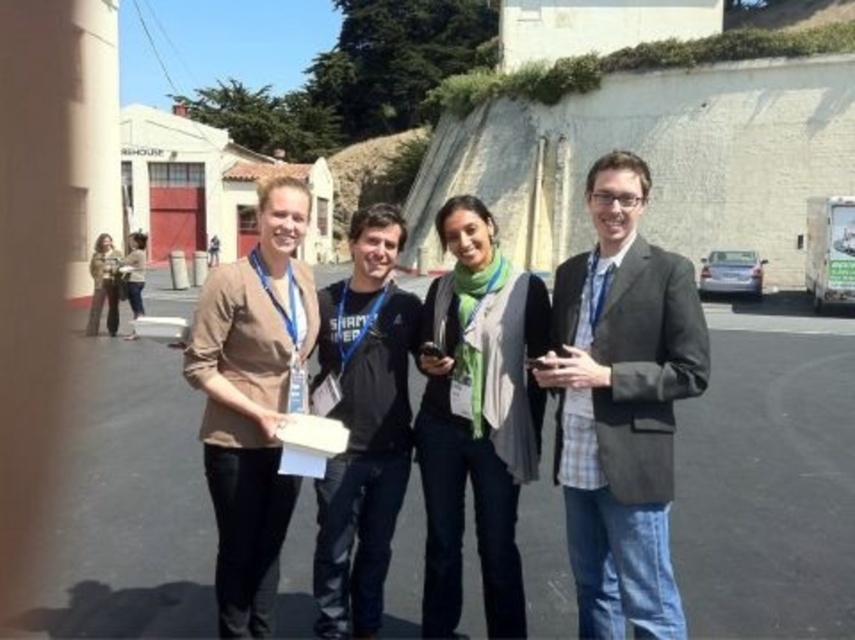
Who is lower down, matte gray blazer at center or green knitted scarf at center?

green knitted scarf at center is lower down.

Is point (662, 352) positioned behind point (482, 419)?

No.

Image resolution: width=855 pixels, height=640 pixels. Identify the location of matte gray blazer at center. (621, 406).

Can you confirm if black cotton t-shirt at center is taller than matte beige sweater at left?

Yes, black cotton t-shirt at center is taller than matte beige sweater at left.

Is black cotton t-shirt at center above matte beige sweater at left?

Actually, black cotton t-shirt at center is below matte beige sweater at left.

Describe the element at coordinates (363, 424) in the screenshot. The image size is (855, 640). I see `black cotton t-shirt at center` at that location.

Locate an element on the screen. The image size is (855, 640). black cotton t-shirt at center is located at coordinates (363, 424).

In order to click on green knitted scarf at center in this screenshot , I will do `click(476, 419)`.

Is point (450, 627) more distant than point (110, 310)?

No, (450, 627) is in front of (110, 310).

Which is in front, point (526, 326) or point (97, 257)?

Point (526, 326) is more forward.

The height and width of the screenshot is (640, 855). I want to click on green knitted scarf at center, so click(476, 419).